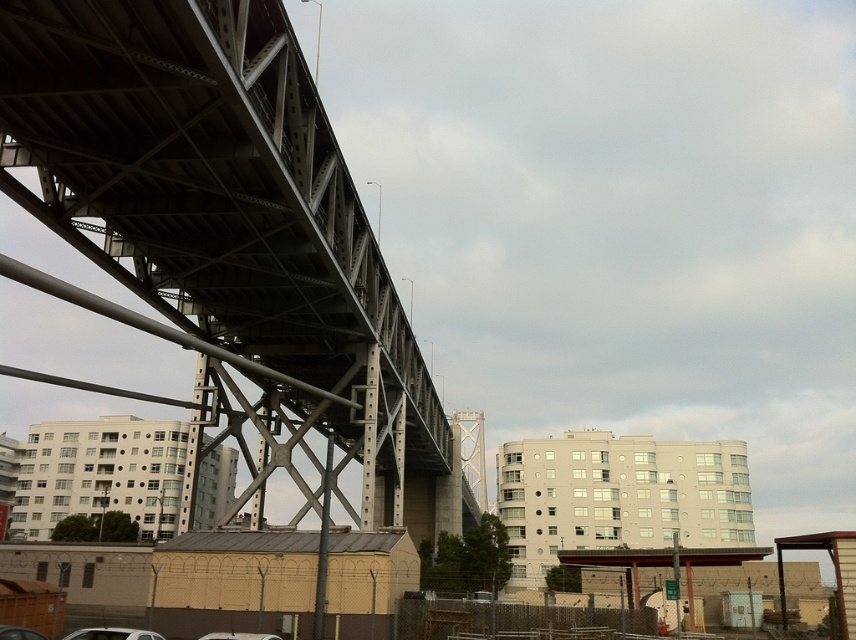
You are a delivery drone that needs to fly from the metallic gray bridge at upper left to the white matte car at lower left. The drone has a maximum flight distance of 25 meters. Can it make the trip without recharging?

The distance between the metallic gray bridge at upper left and the white matte car at lower left is 26.73 meters, which exceeds the drone s maximum flight distance of 25 meters. Therefore, the drone cannot make the trip without recharging.

You are standing on the sidewalk below the metallic gray bridge at upper left and want to take a photo of the white matte car at lower left parked nearby. Which object should you look up towards to frame the shot properly?

You should look up towards the metallic gray bridge at upper left because it is taller than the white matte car at lower left, so positioning the camera to include the bridge in the upper part of the frame will help capture the car below effectively.

You are driving a white matte car at lower left and want to exit the area. The metallic gray bridge at upper left is blocking your path. Is there a way to go around it?

The metallic gray bridge at upper left is in front of the white matte car at lower left, so you can go around it by moving to either the left or right side of the bridge to bypass the obstruction.